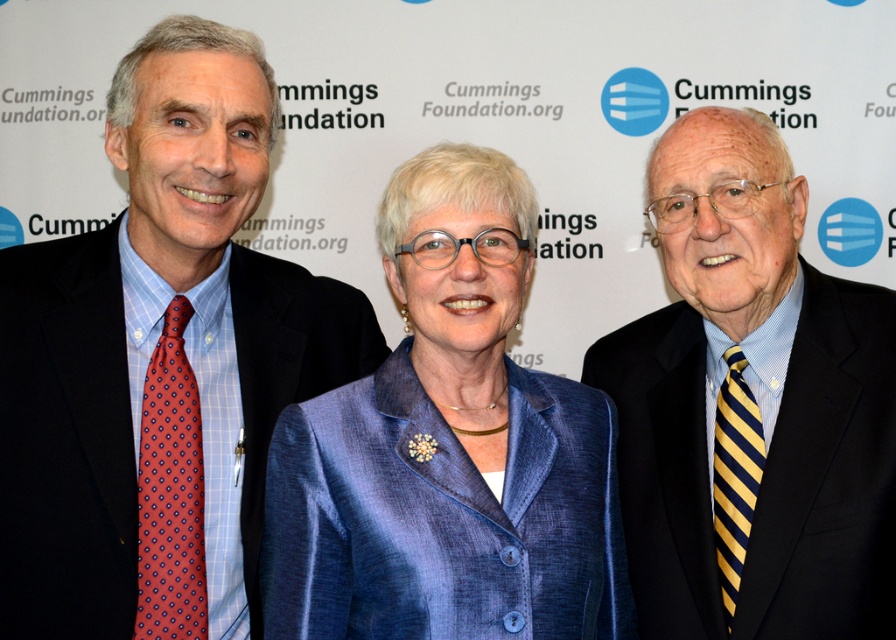
Does matte black suit at left appear on the left side of blue satin blazer at center?

Correct, you'll find matte black suit at left to the left of blue satin blazer at center.

Is matte black suit at left further to camera compared to blue satin blazer at center?

Yes, matte black suit at left is further from the viewer.

Which is in front, point (136, 465) or point (326, 460)?

Point (326, 460)

Locate an element on the screen. This screenshot has height=640, width=896. matte black suit at left is located at coordinates (160, 362).

Can you confirm if blue satin blazer at center is positioned above blue striped tie at right?

No.

From the picture: Which is above, blue satin blazer at center or blue striped tie at right?

blue striped tie at right

Between point (266, 492) and point (672, 342), which one is positioned behind?

The point (672, 342) is more distant.

I want to click on blue satin blazer at center, so click(x=448, y=449).

Is matte black suit at left below blue striped tie at right?

No.

Which is behind, point (119, 444) or point (748, 480)?

The point (748, 480) is behind.

You are a GUI agent. You are given a task and a screenshot of the screen. Output one action in this format:
    pyautogui.click(x=<x>, y=<y>)
    Task: Click on the matte black suit at left
    This screenshot has width=896, height=640.
    Given the screenshot: What is the action you would take?
    pyautogui.click(x=160, y=362)

Locate an element on the screen. This screenshot has height=640, width=896. matte black suit at left is located at coordinates (160, 362).